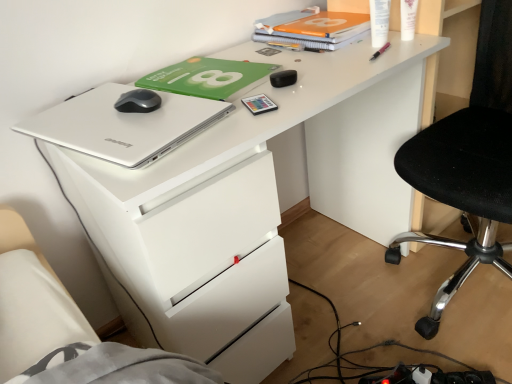
This screenshot has height=384, width=512. Identify the location of silver metallic laptop at upper left. (124, 125).

Describe the element at coordinates (379, 22) in the screenshot. The height and width of the screenshot is (384, 512). I see `white plastic bottle at upper right, which is the second stationery from top to bottom` at that location.

What do you see at coordinates (468, 161) in the screenshot?
I see `black mesh chair at right` at bounding box center [468, 161].

Locate an element on the screen. satin black mouse at upper left is located at coordinates (138, 101).

What do you see at coordinates (138, 101) in the screenshot? I see `satin black mouse at upper left` at bounding box center [138, 101].

The height and width of the screenshot is (384, 512). Identify the location of black matte earbuds at center, the second stationery ordered from the bottom. (283, 78).

The width and height of the screenshot is (512, 384). What do you see at coordinates (209, 78) in the screenshot?
I see `green matte paperback book at upper center` at bounding box center [209, 78].

The image size is (512, 384). I want to click on silver metallic laptop at upper left, so click(x=124, y=125).

Is pink plastic pen at upper right, which is the 3th stationery from bottom to top, located outside white glossy lotion at upper right, marked as the 5th stationery in a left-to-right arrangement?

pink plastic pen at upper right, which is the 3th stationery from bottom to top, is positioned outside white glossy lotion at upper right, marked as the 5th stationery in a left-to-right arrangement.

How many degrees apart are the facing directions of pink plastic pen at upper right, which appears as the third stationery when viewed from the top, and white glossy lotion at upper right, marked as the 5th stationery in a left-to-right arrangement?

The facing directions of pink plastic pen at upper right, which appears as the third stationery when viewed from the top, and white glossy lotion at upper right, marked as the 5th stationery in a left-to-right arrangement, are 38.1 degrees apart.

Does pink plastic pen at upper right, which is the 3th stationery from bottom to top, touch white glossy lotion at upper right, the first stationery when ordered from right to left?

Answer: Yes, pink plastic pen at upper right, which is the 3th stationery from bottom to top, is touching white glossy lotion at upper right, the first stationery when ordered from right to left.

Is black matte earbuds at center, the fourth stationery viewed from the top, not inside silver metallic laptop at upper left?

That's correct, black matte earbuds at center, the fourth stationery viewed from the top, is outside of silver metallic laptop at upper left.

Which of these two, black matte earbuds at center, the fourth stationery viewed from the top, or silver metallic laptop at upper left, stands taller?

black matte earbuds at center, the fourth stationery viewed from the top, is taller.

From a real-world perspective, starting from the silver metallic laptop at upper left, which stationery is the 1st one below it? Please provide its 2D coordinates.

[(283, 78)]

Is black matte earbuds at center, acting as the second stationery starting from the left, not close to silver metallic laptop at upper left?

No.

Is black mesh chair at right next to white plastic bottle at upper right, which is the second stationery from top to bottom, and touching it?

black mesh chair at right and white plastic bottle at upper right, which is the second stationery from top to bottom, are clearly separated.

Between black mesh chair at right and white plastic bottle at upper right, which is the second stationery from top to bottom, which one has smaller size?

white plastic bottle at upper right, which is the second stationery from top to bottom, is smaller.

Which of these two, black mesh chair at right or white plastic bottle at upper right, acting as the second stationery starting from the right, is wider?

Wider between the two is black mesh chair at right.

I want to click on chair in front of the white plastic bottle at upper right, which is the fourth stationery from left to right, so click(x=468, y=161).

Considering the relative sizes of silver metallic laptop at upper left and matte plastic card at center, acting as the fifth stationery starting from the top, in the image provided, is silver metallic laptop at upper left taller than matte plastic card at center, acting as the fifth stationery starting from the top,?

Yes.

Is silver metallic laptop at upper left situated inside matte plastic card at center, which is counted as the 1th stationery, starting from the left, or outside?

silver metallic laptop at upper left exists outside the volume of matte plastic card at center, which is counted as the 1th stationery, starting from the left.

From the image's perspective, who appears lower, silver metallic laptop at upper left or matte plastic card at center, placed as the 5th stationery when sorted from right to left?

silver metallic laptop at upper left.

Consider the image. Looking at the image, does matte plastic card at center, which ranks as the 1th stationery in bottom-to-top order, seem bigger or smaller compared to green matte paperback book at upper center?

In the image, matte plastic card at center, which ranks as the 1th stationery in bottom-to-top order, appears to be smaller than green matte paperback book at upper center.

From a real-world perspective, which is physically above, matte plastic card at center, which is counted as the 1th stationery, starting from the left, or green matte paperback book at upper center?

green matte paperback book at upper center, from a real-world perspective.

Is point (251, 101) farther from camera compared to point (239, 83)?

No, (251, 101) is in front of (239, 83).

Measure the distance from matte plastic card at center, acting as the fifth stationery starting from the top, to green matte paperback book at upper center.

The distance of matte plastic card at center, acting as the fifth stationery starting from the top, from green matte paperback book at upper center is 6.94 inches.

Does white plastic bottle at upper right, acting as the second stationery starting from the right, appear on the right side of white glossy lotion at upper right, which is the first stationery in top-to-bottom order?

Incorrect, white plastic bottle at upper right, acting as the second stationery starting from the right, is not on the right side of white glossy lotion at upper right, which is the first stationery in top-to-bottom order.

Does point (382, 15) come farther from viewer compared to point (409, 27)?

No, it is not.

Considering the relative sizes of white plastic bottle at upper right, acting as the second stationery starting from the right, and white glossy lotion at upper right, which is counted as the fifth stationery, starting from the bottom, in the image provided, is white plastic bottle at upper right, acting as the second stationery starting from the right, smaller than white glossy lotion at upper right, which is counted as the fifth stationery, starting from the bottom,?

Yes, white plastic bottle at upper right, acting as the second stationery starting from the right, is smaller than white glossy lotion at upper right, which is counted as the fifth stationery, starting from the bottom.

Considering the sizes of objects white plastic bottle at upper right, which is the second stationery from top to bottom, and white glossy lotion at upper right, which is the first stationery in top-to-bottom order, in the image provided, who is thinner, white plastic bottle at upper right, which is the second stationery from top to bottom, or white glossy lotion at upper right, which is the first stationery in top-to-bottom order,?

white glossy lotion at upper right, which is the first stationery in top-to-bottom order, is thinner.

From their relative heights in the image, would you say satin black mouse at upper left is taller or shorter than pink plastic pen at upper right, which appears as the third stationery when viewed from the top?

Considering their sizes, satin black mouse at upper left has more height than pink plastic pen at upper right, which appears as the third stationery when viewed from the top.

What's the angular difference between satin black mouse at upper left and pink plastic pen at upper right, which appears as the third stationery when viewed from the top,'s facing directions?

12.9 degrees.

This screenshot has height=384, width=512. I want to click on the 3rd stationery counting from the right of the satin black mouse at upper left, so click(x=380, y=51).

Do you think satin black mouse at upper left is within pink plastic pen at upper right, which appears as the third stationery when viewed from the right, or outside of it?

satin black mouse at upper left exists outside the volume of pink plastic pen at upper right, which appears as the third stationery when viewed from the right.

Image resolution: width=512 pixels, height=384 pixels. There is a white glossy lotion at upper right, which is the first stationery in top-to-bottom order. Find the location of `the 2nd stationery below it (from the image's perspective)`. the 2nd stationery below it (from the image's perspective) is located at coordinates (380, 51).

From the silver metallic laptop at upper left, count 2nd stationery to the right and point to it. Please provide its 2D coordinates.

[(283, 78)]

Estimate the real-world distances between objects in this image. Which object is further from pink plastic pen at upper right, which appears as the third stationery when viewed from the top, satin black mouse at upper left or matte plastic card at center, acting as the fifth stationery starting from the top?

satin black mouse at upper left.

Which object lies nearer to the anchor point orange matte notebook at upper center, black mesh chair at right or silver metallic laptop at upper left?

Based on the image, black mesh chair at right appears to be nearer to orange matte notebook at upper center.

When comparing their distances from satin black mouse at upper left, does matte plastic card at center, acting as the fifth stationery starting from the top, or silver metallic laptop at upper left seem closer?

silver metallic laptop at upper left is closer to satin black mouse at upper left.

From the picture: Which object lies further to the anchor point black matte earbuds at center, the fourth stationery viewed from the top, black mesh chair at right or orange matte notebook at upper center?

Among the two, black mesh chair at right is located further to black matte earbuds at center, the fourth stationery viewed from the top.

Looking at the image, which one is located further to black mesh chair at right, silver metallic laptop at upper left or white glossy lotion at upper right, the first stationery when ordered from right to left?

silver metallic laptop at upper left lies further to black mesh chair at right than the other object.

Looking at the image, which one is located closer to orange matte notebook at upper center, green matte paperback book at upper center or satin black mouse at upper left?

green matte paperback book at upper center is positioned closer to the anchor orange matte notebook at upper center.

Looking at the image, which one is located closer to black mesh chair at right, satin black mouse at upper left or green matte paperback book at upper center?

green matte paperback book at upper center is positioned closer to the anchor black mesh chair at right.

From the picture: Which object lies further to the anchor point orange matte notebook at upper center, black matte earbuds at center, the 4th stationery when ordered from right to left, or white plastic bottle at upper right, acting as the second stationery starting from the right?

black matte earbuds at center, the 4th stationery when ordered from right to left, is positioned further to the anchor orange matte notebook at upper center.

The height and width of the screenshot is (384, 512). Identify the location of paperback book between silver metallic laptop at upper left and white plastic bottle at upper right, which is counted as the fourth stationery, starting from the bottom. (x=209, y=78).

Locate an element on the screen. paperback book between satin black mouse at upper left and black matte earbuds at center, acting as the second stationery starting from the left, in the horizontal direction is located at coordinates (209, 78).

The image size is (512, 384). Find the location of `stationery situated between silver metallic laptop at upper left and black matte earbuds at center, acting as the second stationery starting from the left, from left to right`. stationery situated between silver metallic laptop at upper left and black matte earbuds at center, acting as the second stationery starting from the left, from left to right is located at coordinates (259, 104).

Where is `paperback book between silver metallic laptop at upper left and matte plastic card at center, which ranks as the 1th stationery in bottom-to-top order, in the horizontal direction`? The width and height of the screenshot is (512, 384). paperback book between silver metallic laptop at upper left and matte plastic card at center, which ranks as the 1th stationery in bottom-to-top order, in the horizontal direction is located at coordinates (209, 78).